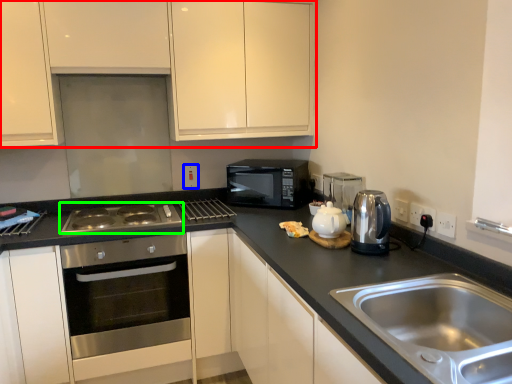
Question: Based on their relative distances, which object is farther from cabinetry (highlighted by a red box)? Choose from electric outlet (highlighted by a blue box) and gas stove (highlighted by a green box).

Choices:
 (A) electric outlet
 (B) gas stove

Answer: (A)